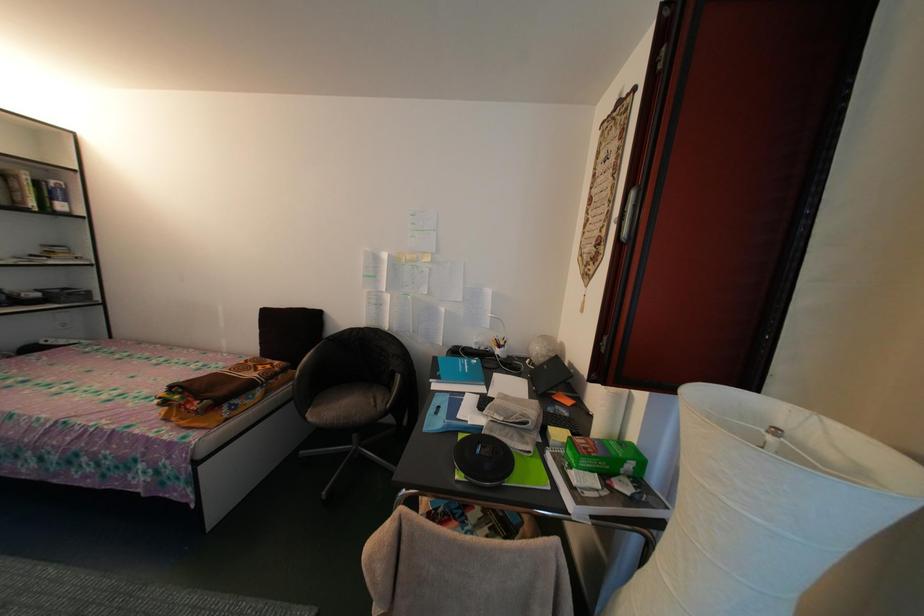
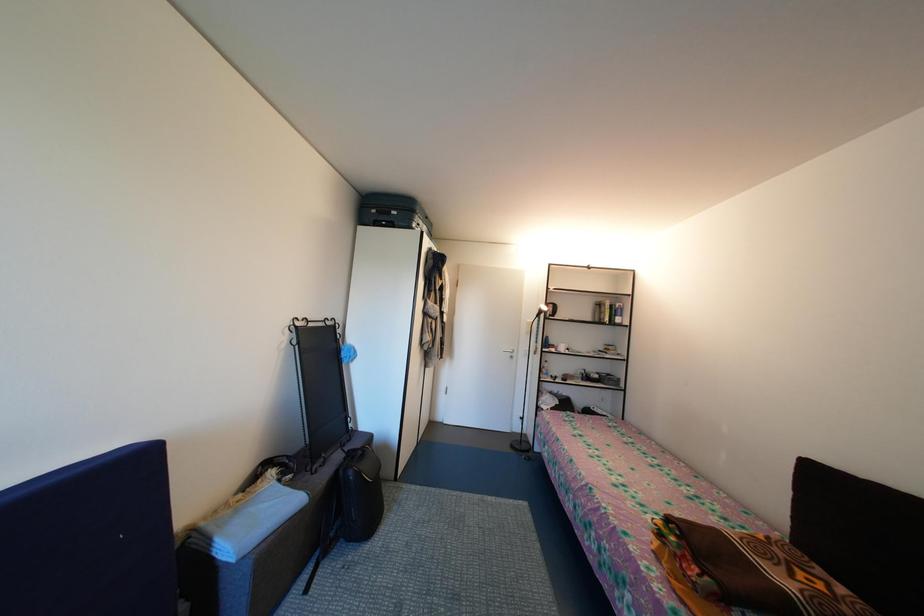
Question: The first image is from the beginning of the video and the second image is from the end. How did the camera likely rotate when shooting the video?

Choices:
 (A) Left
 (B) Right
 (C) Up
 (D) Down

Answer: (A)